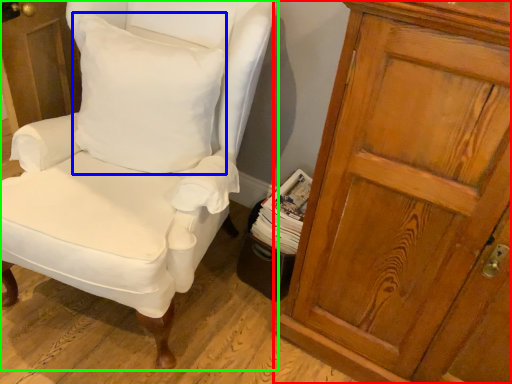
Question: Which is farther away from cupboard (highlighted by a red box)? pillow (highlighted by a blue box) or chair (highlighted by a green box)?

Choices:
 (A) pillow
 (B) chair

Answer: (A)